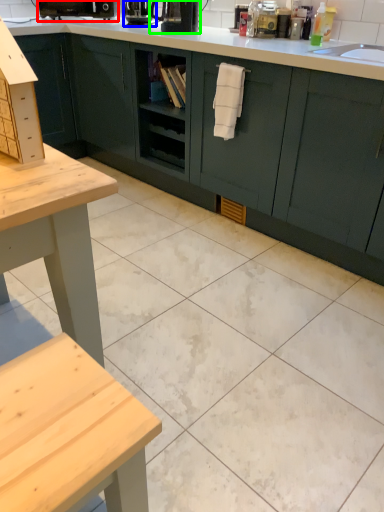
Question: Considering the real-world distances, which object is closest to coffee machine (highlighted by a red box)? coffee machine (highlighted by a blue box) or coffee machine (highlighted by a green box).

Choices:
 (A) coffee machine
 (B) coffee machine

Answer: (A)